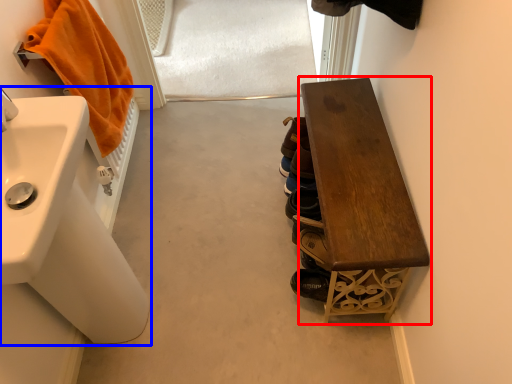
Question: Among these objects, which one is nearest to the camera, furniture (highlighted by a red box) or sink (highlighted by a blue box)?

Choices:
 (A) furniture
 (B) sink

Answer: (B)